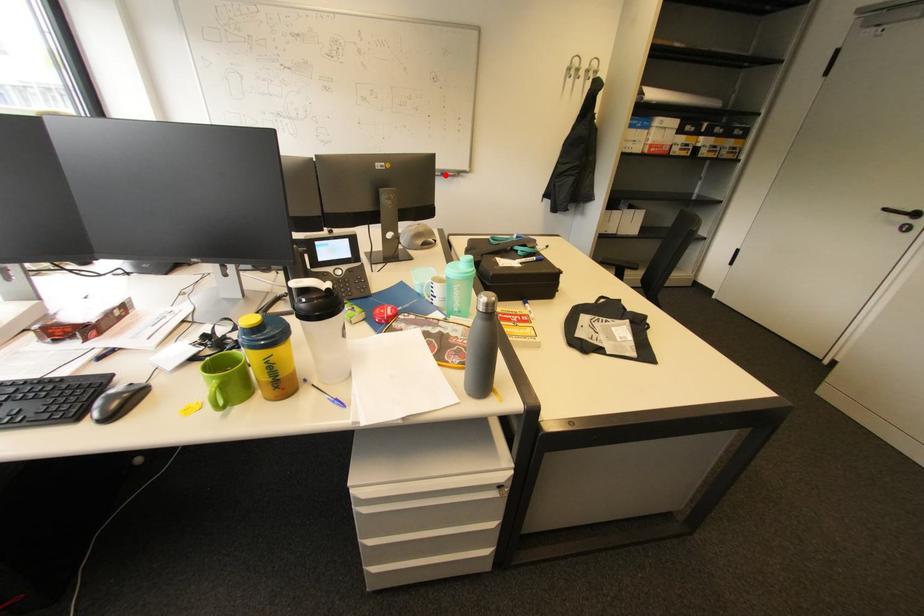
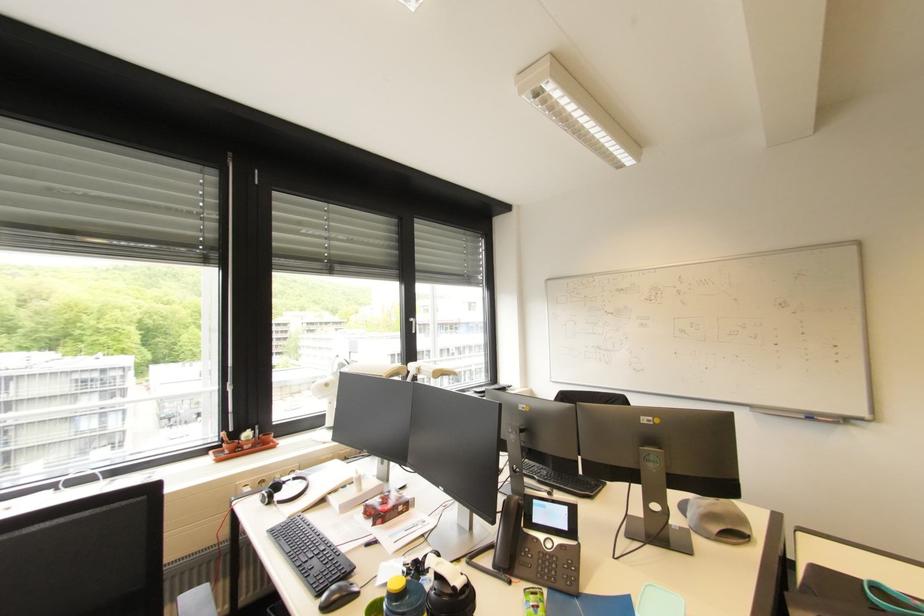
The point at the highlighted location is marked in the first image. Where is the corresponding point in the second image?

(808, 418)